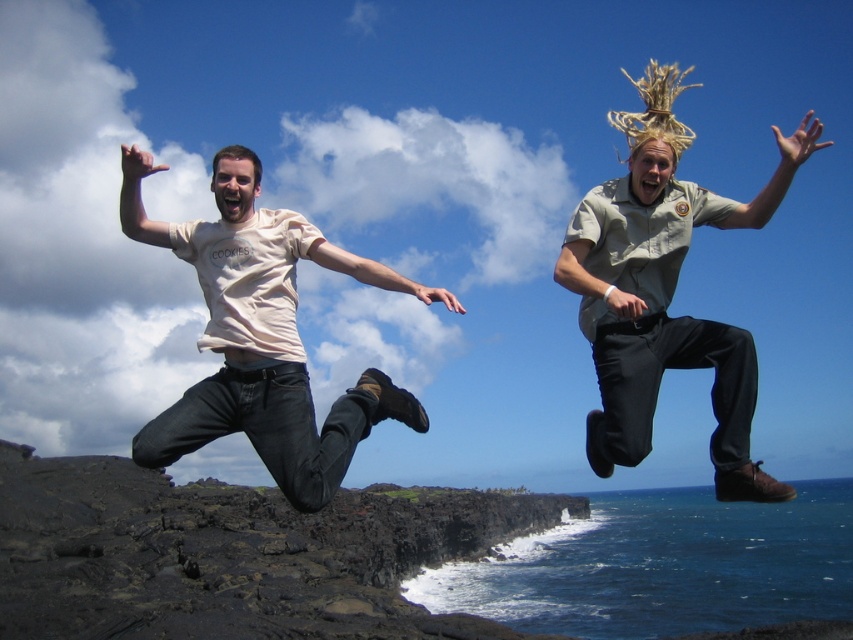
Is point (730, 392) closer to camera compared to point (273, 312)?

Yes, point (730, 392) is in front of point (273, 312).

Between khaki uniform at right and matte beige t-shirt at left, which one is positioned higher?

khaki uniform at right

Between point (611, 189) and point (271, 428), which one is positioned behind?

Positioned behind is point (611, 189).

This screenshot has height=640, width=853. In order to click on khaki uniform at right in this screenshot , I will do [x=665, y=291].

Which of these two, black volcanic rock at lower left or matte beige t-shirt at left, stands taller?

Standing taller between the two is black volcanic rock at lower left.

Can you confirm if black volcanic rock at lower left is smaller than matte beige t-shirt at left?

Actually, black volcanic rock at lower left might be larger than matte beige t-shirt at left.

Where is `black volcanic rock at lower left`? This screenshot has width=853, height=640. black volcanic rock at lower left is located at coordinates (234, 554).

Locate an element on the screen. Image resolution: width=853 pixels, height=640 pixels. black volcanic rock at lower left is located at coordinates (234, 554).

Is point (293, 586) in front of point (621, 268)?

That is False.

Based on the photo, can you confirm if black volcanic rock at lower left is smaller than khaki uniform at right?

Yes.

Is point (86, 513) in front of point (757, 220)?

No, (86, 513) is behind (757, 220).

Find the location of a particular element. black volcanic rock at lower left is located at coordinates (234, 554).